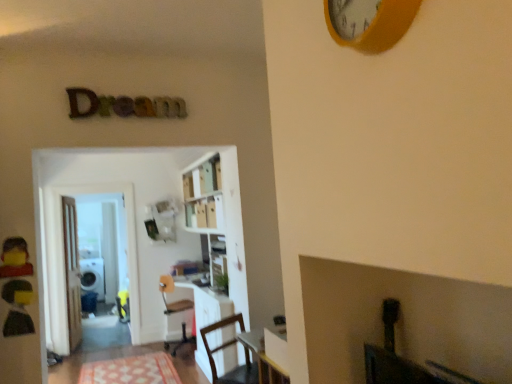
What do you see at coordinates (131, 370) in the screenshot? The height and width of the screenshot is (384, 512). I see `patterned fabric mat at lower center` at bounding box center [131, 370].

Describe the element at coordinates (72, 271) in the screenshot. I see `wooden door at left` at that location.

Locate an element on the screen. white glossy bookcase at center is located at coordinates (220, 246).

The image size is (512, 384). Describe the element at coordinates (176, 315) in the screenshot. I see `matte white chair at center, the 2th chair in the right-to-left sequence` at that location.

What are the coordinates of `patterned fabric mat at lower center` in the screenshot? It's located at (131, 370).

From the image's perspective, is white glossy bookcase at center on top of wooden door at left?

Correct, white glossy bookcase at center appears higher than wooden door at left in the image.

Is white glossy bookcase at center beside wooden door at left?

white glossy bookcase at center and wooden door at left are not in contact.

Can you confirm if white glossy bookcase at center is positioned to the left of wooden door at left?

No.

Who is smaller, transparent glass door at left or patterned fabric mat at lower center?

→ patterned fabric mat at lower center is smaller.

Which object is positioned more to the right, transparent glass door at left or patterned fabric mat at lower center?

From the viewer's perspective, patterned fabric mat at lower center appears more on the right side.

Which object is further away from the camera, transparent glass door at left or patterned fabric mat at lower center?

Positioned behind is transparent glass door at left.

Locate an element on the screen. The width and height of the screenshot is (512, 384). glass door positioned vertically above the wooden chair at lower center, which ranks as the 2th chair in left-to-right order (from a real-world perspective) is located at coordinates (126, 233).

In the scene shown: Does transparent glass door at left turn towards wooden chair at lower center, which ranks as the 2th chair in left-to-right order?

Yes, transparent glass door at left is turned towards wooden chair at lower center, which ranks as the 2th chair in left-to-right order.

Considering the sizes of objects transparent glass door at left and wooden chair at lower center, which ranks as the 2th chair in left-to-right order, in the image provided, who is smaller, transparent glass door at left or wooden chair at lower center, which ranks as the 2th chair in left-to-right order,?

transparent glass door at left is smaller.

Is transparent glass door at left located outside wooden chair at lower center, which ranks as the 2th chair in left-to-right order?

Yes, transparent glass door at left is not within wooden chair at lower center, which ranks as the 2th chair in left-to-right order.

Is wooden door at left positioned before patterned fabric mat at lower center?

No, wooden door at left is further to the viewer.

From a real-world perspective, is wooden door at left above or below patterned fabric mat at lower center?

wooden door at left is situated higher than patterned fabric mat at lower center in the real world.

Is wooden door at left positioned with its back to patterned fabric mat at lower center?

No, patterned fabric mat at lower center is not at the back of wooden door at left.

Is wooden chair at lower center, acting as the 1th chair starting from the right, looking in the opposite direction of white glossy bookcase at center?

That's not correct — wooden chair at lower center, acting as the 1th chair starting from the right, is not looking away from white glossy bookcase at center.

Is wooden chair at lower center, which ranks as the 2th chair in left-to-right order, in front of or behind white glossy bookcase at center in the image?

wooden chair at lower center, which ranks as the 2th chair in left-to-right order, is positioned closer to the viewer than white glossy bookcase at center.

Consider the image. Between wooden chair at lower center, the 2th chair viewed from the back, and white glossy bookcase at center, which one has more height?

white glossy bookcase at center.

Which object is positioned more to the left, wooden chair at lower center, the 2th chair viewed from the back, or white glossy bookcase at center?

Positioned to the left is white glossy bookcase at center.

In the scene shown: Between patterned fabric mat at lower center and white glossy bookcase at center, which one has larger size?

Bigger between the two is white glossy bookcase at center.

Considering the relative sizes of patterned fabric mat at lower center and white glossy bookcase at center in the image provided, is patterned fabric mat at lower center wider than white glossy bookcase at center?

Yes.

From a real-world perspective, which is physically above, patterned fabric mat at lower center or white glossy bookcase at center?

From a 3D spatial view, white glossy bookcase at center is above.

Considering the relative positions of patterned fabric mat at lower center and white glossy bookcase at center in the image provided, is patterned fabric mat at lower center to the right of white glossy bookcase at center from the viewer's perspective?

Incorrect, patterned fabric mat at lower center is not on the right side of white glossy bookcase at center.

Which of these two, transparent glass door at left or white glossy bookcase at center, stands taller?

white glossy bookcase at center is taller.

From the image's perspective, is transparent glass door at left beneath white glossy bookcase at center?

Correct, transparent glass door at left appears lower than white glossy bookcase at center in the image.

Which point is more forward, (128, 227) or (196, 183)?

Positioned in front is point (196, 183).

Where is `bookcase on the right of wooden door at left`? bookcase on the right of wooden door at left is located at coordinates (220, 246).

Identify the location of mat below the transparent glass door at left (from the image's perspective). (131, 370).

Based on their spatial positions, is yellow matte clock at upper center or wooden chair at lower center, the 2th chair viewed from the back, closer to patterned fabric mat at lower center?

wooden chair at lower center, the 2th chair viewed from the back, is closer to patterned fabric mat at lower center.

Based on their spatial positions, is matte white chair at center, which appears as the first chair when viewed from the back, or wooden chair at lower center, which ranks as the 2th chair in left-to-right order, further from white glossy bookcase at center?

Among the two, matte white chair at center, which appears as the first chair when viewed from the back, is located further to white glossy bookcase at center.

From the image, which object appears to be nearer to patterned fabric mat at lower center, matte white chair at center, which appears as the first chair when viewed from the back, or yellow matte clock at upper center?

matte white chair at center, which appears as the first chair when viewed from the back, lies closer to patterned fabric mat at lower center than the other object.

Based on their spatial positions, is wooden door at left or patterned fabric mat at lower center further from white glossy bookcase at center?

Based on the image, wooden door at left appears to be further to white glossy bookcase at center.

Estimate the real-world distances between objects in this image. Which object is further from transparent glass door at left, yellow matte clock at upper center or matte white chair at center, which is counted as the second chair, starting from the front?

Among the two, yellow matte clock at upper center is located further to transparent glass door at left.

From the image, which object appears to be farther from wooden door at left, white glossy bookcase at center or wooden chair at lower center, which ranks as the 2th chair in left-to-right order?

Based on the image, wooden chair at lower center, which ranks as the 2th chair in left-to-right order, appears to be further to wooden door at left.

Based on the photo, from the image, which object appears to be nearer to transparent glass door at left, matte white chair at center, which appears as the first chair when viewed from the back, or patterned fabric mat at lower center?

matte white chair at center, which appears as the first chair when viewed from the back, is positioned closer to the anchor transparent glass door at left.

From the image, which object appears to be farther from matte white chair at center, placed as the 1th chair when sorted from left to right, patterned fabric mat at lower center or yellow matte clock at upper center?

yellow matte clock at upper center is positioned further to the anchor matte white chair at center, placed as the 1th chair when sorted from left to right.

Locate an element on the screen. The height and width of the screenshot is (384, 512). chair between yellow matte clock at upper center and patterned fabric mat at lower center in the front-back direction is located at coordinates [x=226, y=347].

At what (x,y) coordinates should I click in order to perform the action: click on mat positioned between white glossy bookcase at center and wooden door at left from near to far. Please return your answer as a coordinate pair (x, y). Looking at the image, I should click on (131, 370).

Identify the location of glass door between yellow matte clock at upper center and wooden door at left along the z-axis. (126, 233).

This screenshot has height=384, width=512. What are the coordinates of `mat between yellow matte clock at upper center and transparent glass door at left from front to back` in the screenshot? It's located at (131, 370).